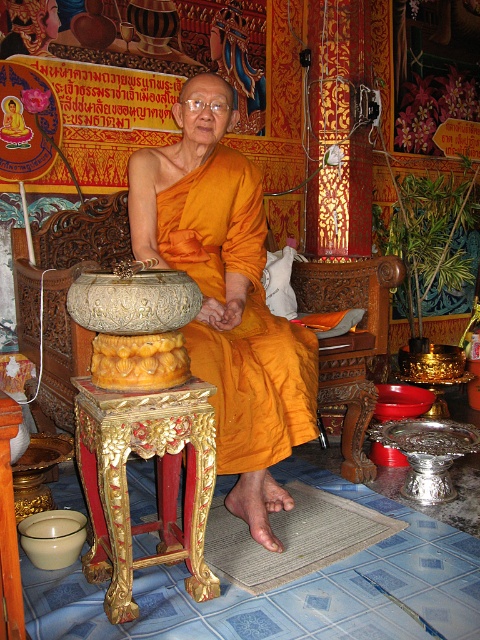
Question: Is matte orange robe at center wider than carved wood chair at center?

Choices:
 (A) yes
 (B) no

Answer: (A)

Question: Is matte orange robe at center wider than carved wood chair at center?

Choices:
 (A) no
 (B) yes

Answer: (B)

Question: Does matte orange robe at center have a smaller size compared to carved wood chair at center?

Choices:
 (A) no
 (B) yes

Answer: (A)